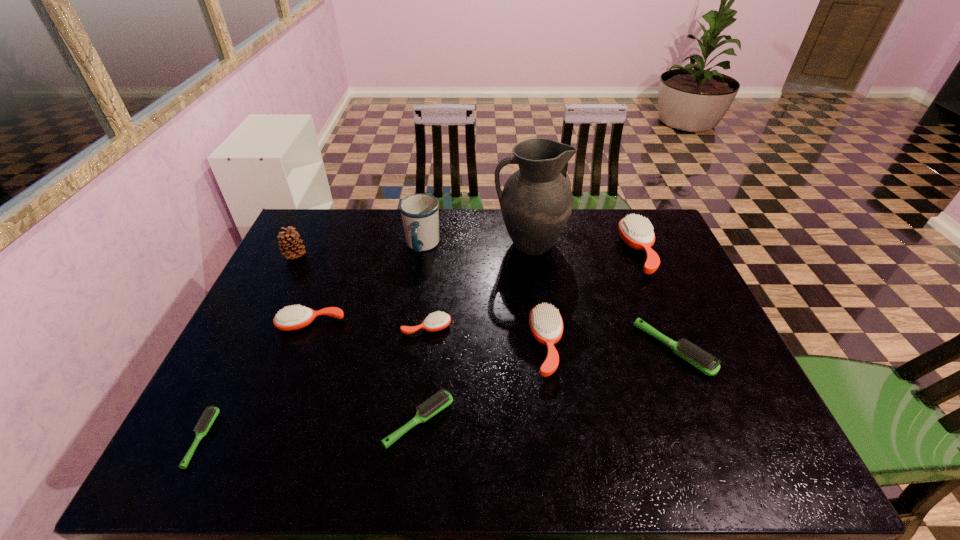
Where is `mug that is at the far edge`? The image size is (960, 540). mug that is at the far edge is located at coordinates (420, 212).

Identify the location of pinecone that is at the far edge. (288, 243).

The height and width of the screenshot is (540, 960). What are the coordinates of `hairbrush positioned at the far edge` in the screenshot? It's located at (637, 232).

Where is `pinecone located in the left edge section of the desktop`? Image resolution: width=960 pixels, height=540 pixels. pinecone located in the left edge section of the desktop is located at coordinates (288, 243).

Identify the location of object located at the far left corner. The height and width of the screenshot is (540, 960). (288, 243).

This screenshot has width=960, height=540. In order to click on object that is at the near left corner in this screenshot , I will do `click(211, 413)`.

Where is `object located at the far right corner`? The height and width of the screenshot is (540, 960). object located at the far right corner is located at coordinates (637, 232).

In the image, there is a desktop. Where is `vacant space at the far edge`? The height and width of the screenshot is (540, 960). vacant space at the far edge is located at coordinates (367, 226).

In the image, there is a desktop. Identify the location of vacant space at the near edge. This screenshot has width=960, height=540. (557, 468).

Locate an element on the screen. This screenshot has width=960, height=540. free space at the right edge of the desktop is located at coordinates (714, 357).